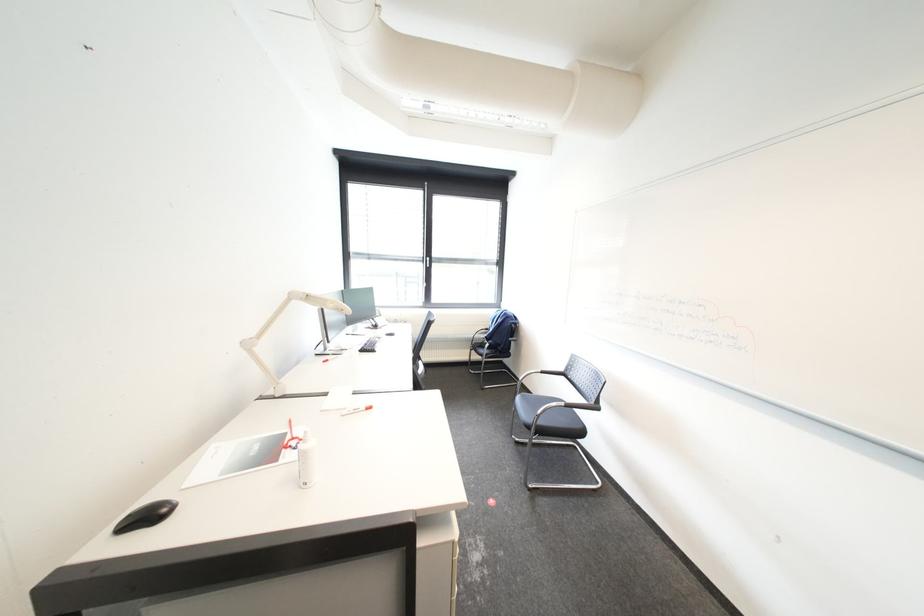
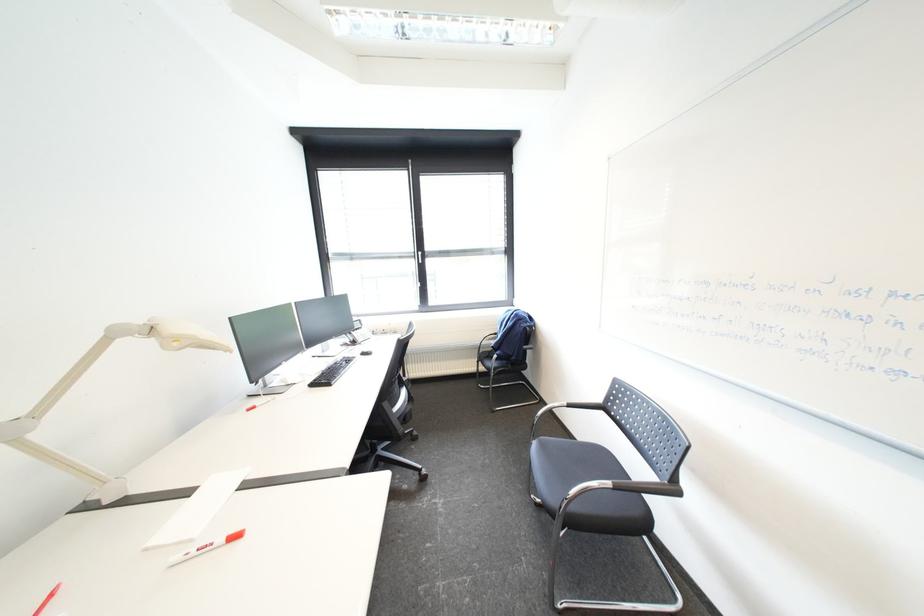
Question: How did the camera likely rotate?

Choices:
 (A) Left
 (B) Right
 (C) Up
 (D) Down

Answer: (A)